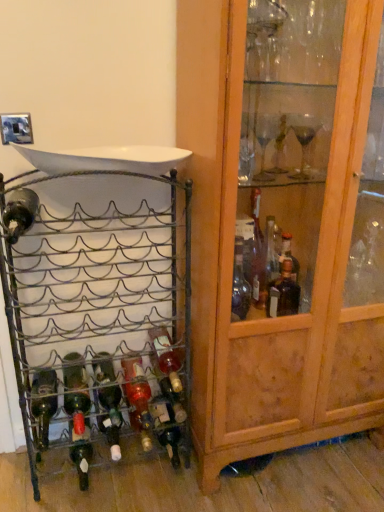
You are a GUI agent. You are given a task and a screenshot of the screen. Output one action in this format:
    pyautogui.click(x=<x>, y=<y>)
    Task: Click on the vacant area to the right of translucent glass bottle at lower left, positioned as the third bottle in left-to-right order
    The width and height of the screenshot is (384, 512).
    Given the screenshot: What is the action you would take?
    pyautogui.click(x=132, y=472)